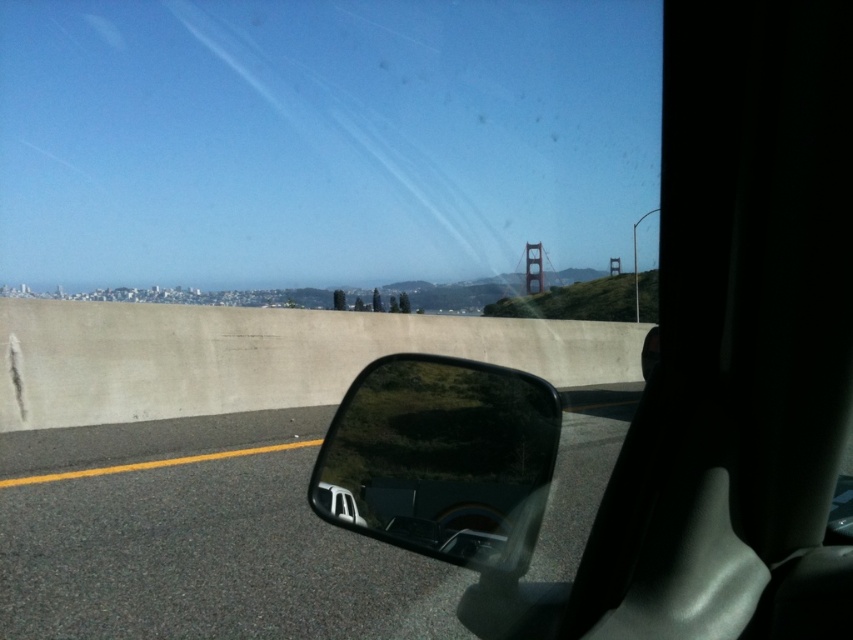
You are a GUI agent. You are given a task and a screenshot of the screen. Output one action in this format:
    pyautogui.click(x=<x>, y=<y>)
    Task: Click on the black glossy mirror at lower right
    This screenshot has width=853, height=640.
    Given the screenshot: What is the action you would take?
    pyautogui.click(x=196, y=540)

Is black glossy mirror at lower right to the left of transparent glass mirror at center from the viewer's perspective?

Indeed, black glossy mirror at lower right is positioned on the left side of transparent glass mirror at center.

The image size is (853, 640). Identify the location of black glossy mirror at lower right. (196, 540).

Who is more distant from viewer, [83,522] or [531,292]?

The point [531,292] is more distant.

Who is lower down, black glossy mirror at lower right or golden gate bridge at upper right?

black glossy mirror at lower right

At what (x,y) coordinates should I click in order to perform the action: click on black glossy mirror at lower right. Please return your answer as a coordinate pair (x, y). Looking at the image, I should click on [x=196, y=540].

Does transparent glass mirror at center appear on the left side of golden gate bridge at upper right?

Yes, transparent glass mirror at center is to the left of golden gate bridge at upper right.

Which is below, transparent glass mirror at center or golden gate bridge at upper right?

Positioned lower is transparent glass mirror at center.

Between point (378, 422) and point (534, 268), which one is positioned behind?

Positioned behind is point (534, 268).

Locate an element on the screen. Image resolution: width=853 pixels, height=640 pixels. transparent glass mirror at center is located at coordinates (440, 460).